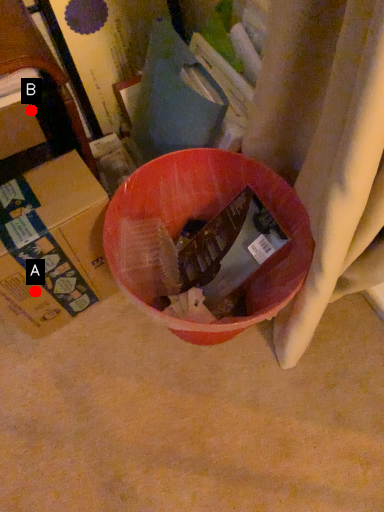
Question: Two points are circled on the image, labeled by A and B beside each circle. Which point is closer to the camera taking this photo?

Choices:
 (A) A is closer
 (B) B is closer

Answer: (A)